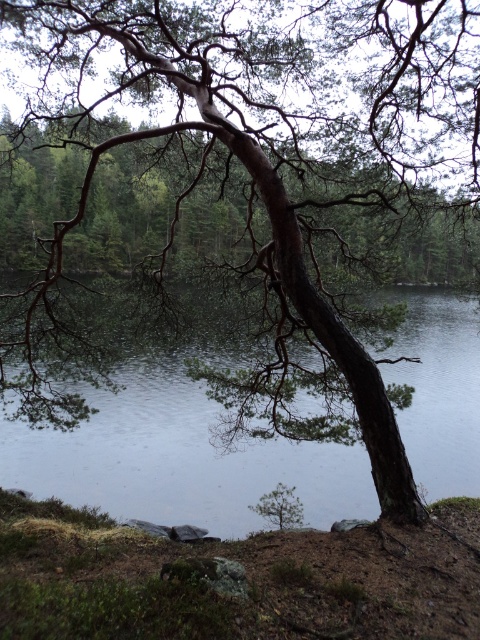
You are a gardener planning to plant flowers in the brown dirt at lower center and the transparent water at center. Considering their widths, which area can accommodate a wider row of flowers?

The brown dirt at lower center has a larger width than the transparent water at center, so it can accommodate a wider row of flowers.

Looking at this image, you are standing at the point marked by the coordinates point [235,580] in the scene. Based on the description, what type of surface are you currently standing on?

The surface at point [235,580] is brown dirt at lower center.

You are standing at the edge of the water in the image. You want to walk to the brown dirt at lower center. Which direction should you move relative to the transparent water at center?

You should move to the right side of the transparent water at center to reach the brown dirt at lower center.